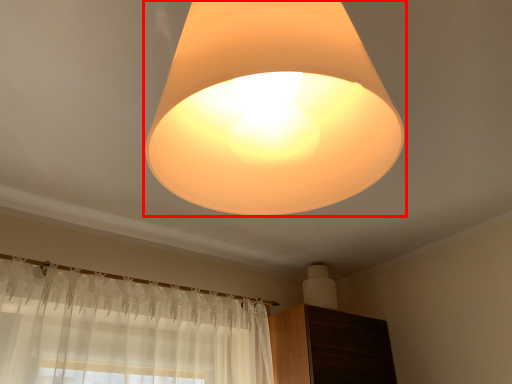
Question: Observing the image, what is the correct spatial positioning of lamp (annotated by the red box) in reference to dresser?

Choices:
 (A) right
 (B) left

Answer: (B)